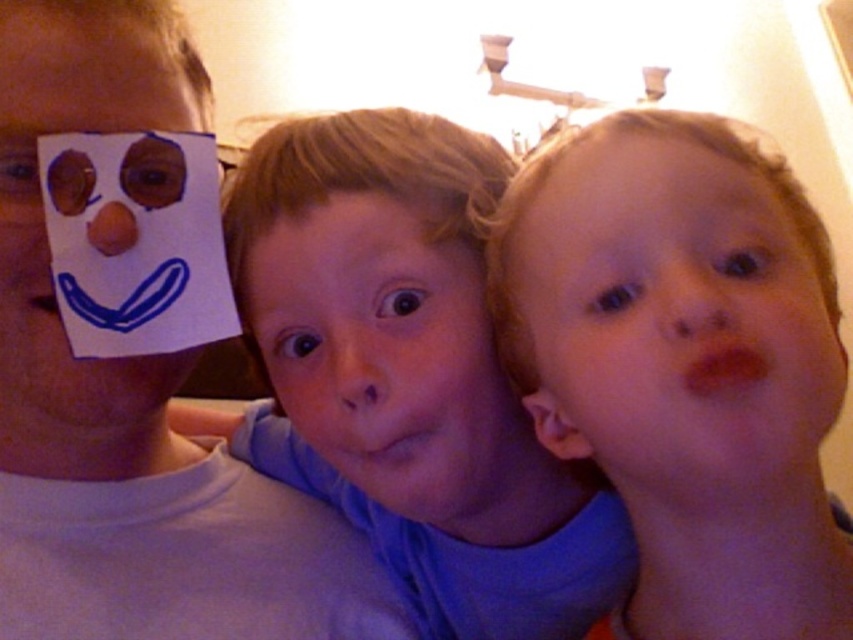
Does smooth blue shirt at center appear under white paper at left?

Correct, smooth blue shirt at center is located below white paper at left.

Does smooth blue shirt at center have a greater height compared to white paper at left?

No.

Locate an element on the screen. The width and height of the screenshot is (853, 640). smooth blue shirt at center is located at coordinates (409, 376).

Does smooth blue shirt at center appear on the right side of matte paper face at left?

Correct, you'll find smooth blue shirt at center to the right of matte paper face at left.

Is smooth blue shirt at center below matte paper face at left?

Yes.

Between point (355, 472) and point (0, 160), which one is positioned in front?

Point (0, 160) is in front.

Identify the location of smooth blue shirt at center. (409, 376).

Who is shorter, smooth blue shirt at center or smooth skin face at right?

smooth skin face at right

Between smooth blue shirt at center and smooth skin face at right, which one has more height?

smooth blue shirt at center is taller.

Who is more forward, (508,561) or (595,417)?

Point (595,417)

The image size is (853, 640). Find the location of `smooth blue shirt at center`. smooth blue shirt at center is located at coordinates (409, 376).